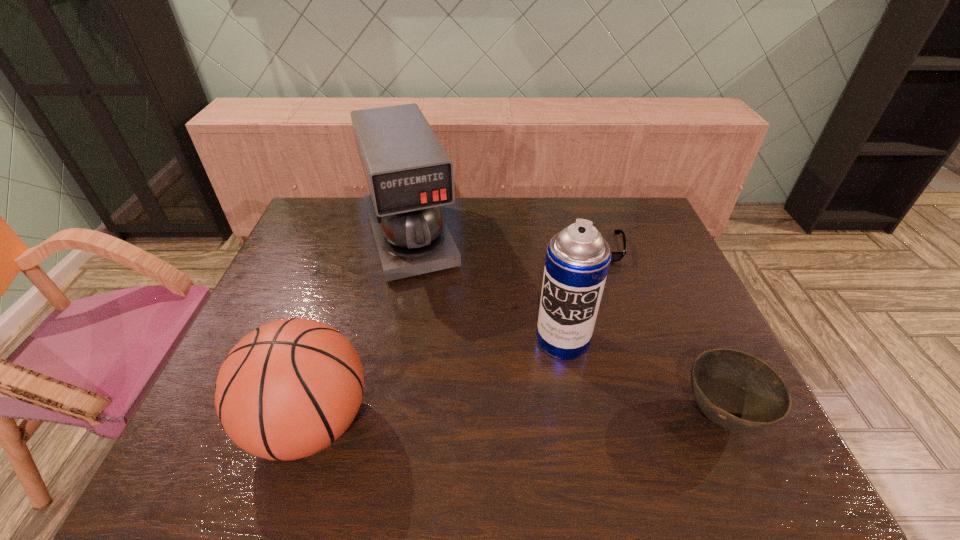
Where is `free region at the near edge of the desktop`? This screenshot has height=540, width=960. free region at the near edge of the desktop is located at coordinates (649, 410).

Locate an element on the screen. The width and height of the screenshot is (960, 540). vacant area at the right edge is located at coordinates (648, 242).

In the image, there is a desktop. Where is `vacant space at the far left corner`? vacant space at the far left corner is located at coordinates (319, 209).

Identify the location of free space that is in between the shortest object and the second shortest object. (659, 330).

The height and width of the screenshot is (540, 960). Identify the location of vacant area that lies between the fourth tallest object and the shortest object. (659, 330).

Where is `vacant point located between the basketball and the second shortest object`? vacant point located between the basketball and the second shortest object is located at coordinates (515, 420).

Image resolution: width=960 pixels, height=540 pixels. I want to click on vacant area that lies between the sunglasses and the basketball, so click(454, 334).

Where is `empty location between the basketball and the fourth tallest object`? This screenshot has height=540, width=960. empty location between the basketball and the fourth tallest object is located at coordinates click(x=515, y=420).

Where is `blank region between the shortest object and the third tallest object`? The image size is (960, 540). blank region between the shortest object and the third tallest object is located at coordinates (454, 334).

Identify which object is the second nearest to the coffee maker. Please provide its 2D coordinates. Your answer should be formatted as a tuple, i.e. [(x, y)], where the tuple contains the x and y coordinates of a point satisfying the conditions above.

[(290, 388)]